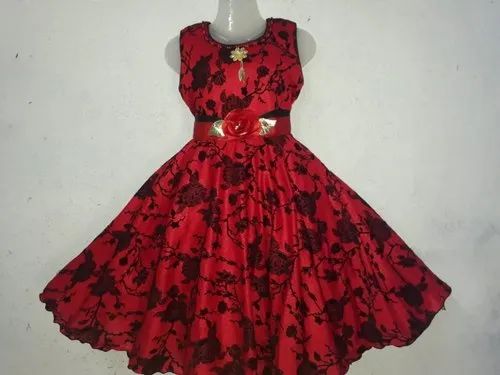
The height and width of the screenshot is (375, 500). What are the coordinates of `mannequin` in the screenshot? It's located at (236, 33).